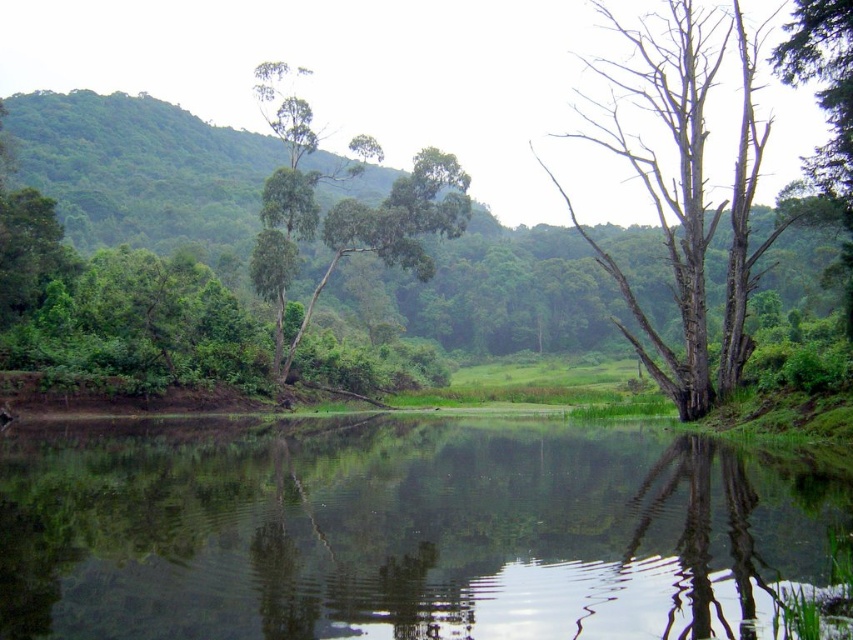
Based on the photo, who is more distant from viewer, [695,36] or [430,214]?

The point [430,214] is more distant.

Between bare wood tree at right and green leafy tree at upper center, which one appears on the left side from the viewer's perspective?

green leafy tree at upper center

Is point (727, 276) behind point (286, 214)?

No, (727, 276) is closer to viewer.

This screenshot has width=853, height=640. I want to click on bare wood tree at right, so click(x=686, y=193).

Which is more to the left, green reflective water at center or bare wood tree at right?

Positioned to the left is green reflective water at center.

Does green reflective water at center have a greater height compared to bare wood tree at right?

No.

Describe the element at coordinates (399, 532) in the screenshot. I see `green reflective water at center` at that location.

You are a GUI agent. You are given a task and a screenshot of the screen. Output one action in this format:
    pyautogui.click(x=<x>, y=<y>)
    Task: Click on the green reflective water at center
    The width and height of the screenshot is (853, 640).
    Given the screenshot: What is the action you would take?
    pyautogui.click(x=399, y=532)

Which of these two, green reflective water at center or green leafy tree at upper center, stands shorter?

Standing shorter between the two is green reflective water at center.

I want to click on green reflective water at center, so pyautogui.click(x=399, y=532).

The width and height of the screenshot is (853, 640). Find the location of `green reflective water at center`. green reflective water at center is located at coordinates (399, 532).